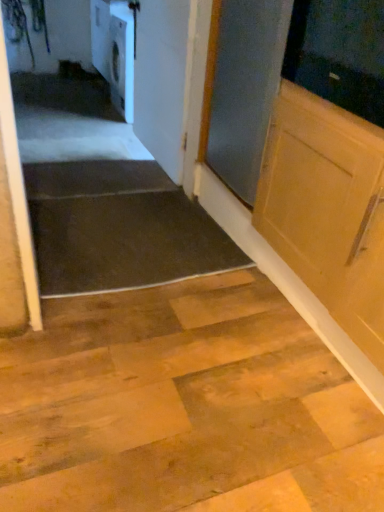
Question: Would you say white glossy dishwasher at upper left is to the left or to the right of white glossy door at upper center in the picture?

Choices:
 (A) right
 (B) left

Answer: (B)

Question: Does point (114, 66) appear closer or farther from the camera than point (148, 45)?

Choices:
 (A) closer
 (B) farther

Answer: (B)

Question: Estimate the real-world distances between objects in this image. Which object is closer to the dark rubber mat at lower left?

Choices:
 (A) white glossy dishwasher at upper left
 (B) white glossy door at upper center

Answer: (B)

Question: Which of these objects is positioned farthest from the dark rubber mat at lower left?

Choices:
 (A) white glossy door at upper center
 (B) white glossy dishwasher at upper left

Answer: (B)